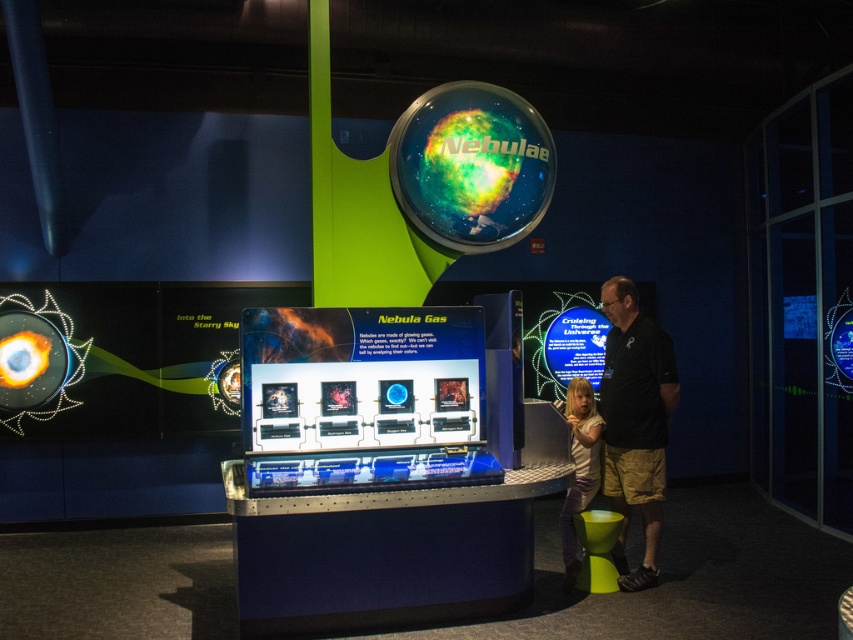
Question: Does light brown hair at lower right lie in front of matte yellow stool at lower right?

Choices:
 (A) yes
 (B) no

Answer: (B)

Question: In this image, where is black cotton shirt at right located relative to light brown hair at lower right?

Choices:
 (A) above
 (B) below

Answer: (A)

Question: Which point appears closest to the camera in this image?

Choices:
 (A) (567, 492)
 (B) (589, 570)

Answer: (B)

Question: Which point appears farthest from the camera in this image?

Choices:
 (A) (628, 285)
 (B) (567, 493)

Answer: (B)

Question: Which of the following is the closest to the observer?

Choices:
 (A) (579, 486)
 (B) (619, 288)
 (C) (584, 563)

Answer: (B)

Question: Can you confirm if black cotton shirt at right is smaller than matte yellow stool at lower right?

Choices:
 (A) no
 (B) yes

Answer: (A)